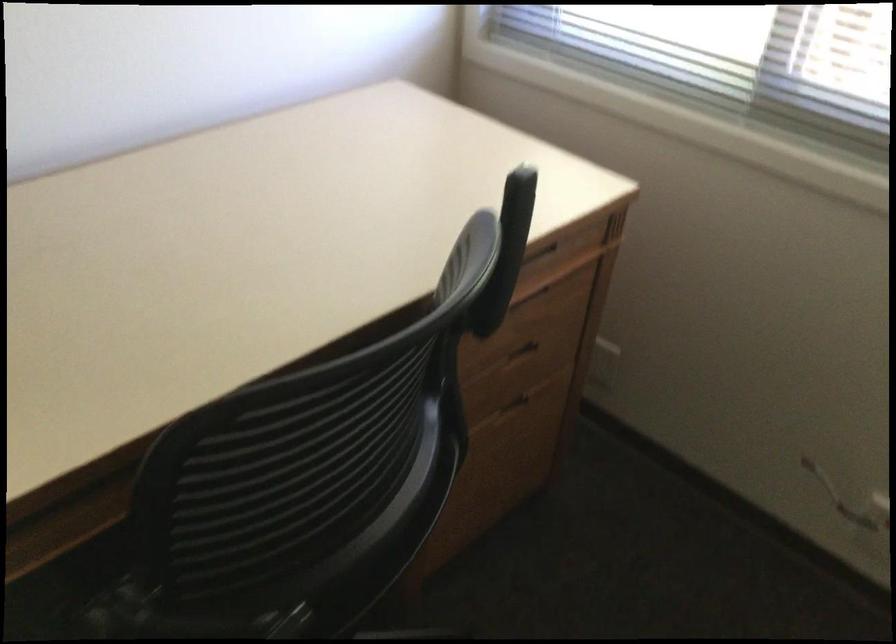
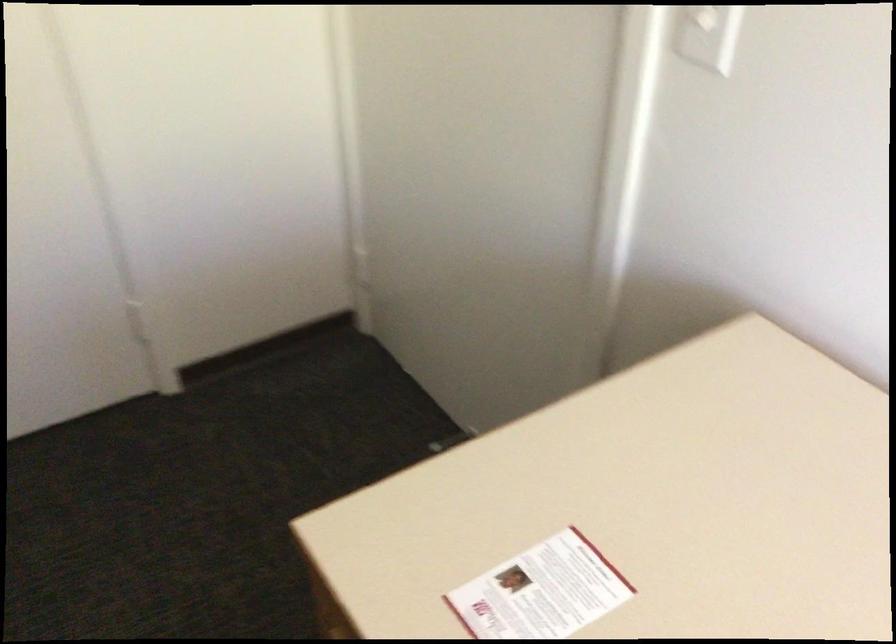
The first image is from the beginning of the video and the second image is from the end. How did the camera likely rotate when shooting the video?

The camera rotated toward left-down.